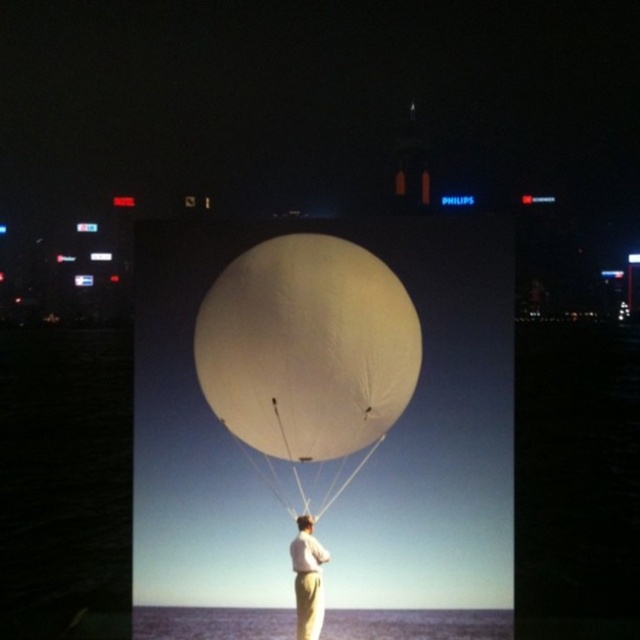
Does transparent plastic water at lower center appear under light beige pants at center?

Correct, transparent plastic water at lower center is located below light beige pants at center.

Is point (269, 632) closer to viewer compared to point (310, 557)?

No, (269, 632) is further to viewer.

Does point (394, 632) lie in front of point (307, 582)?

No.

You are a GUI agent. You are given a task and a screenshot of the screen. Output one action in this format:
    pyautogui.click(x=<x>, y=<y>)
    Task: Click on the transparent plastic water at lower center
    
    Given the screenshot: What is the action you would take?
    pyautogui.click(x=417, y=625)

Can you confirm if white matte balloon at center is bigger than transparent plastic water at lower center?

Indeed, white matte balloon at center has a larger size compared to transparent plastic water at lower center.

Looking at this image, can you confirm if white matte balloon at center is positioned below transparent plastic water at lower center?

No, white matte balloon at center is not below transparent plastic water at lower center.

This screenshot has height=640, width=640. What are the coordinates of `white matte balloon at center` in the screenshot? It's located at (307, 348).

Does white matte balloon at center appear on the left side of light beige pants at center?

Indeed, white matte balloon at center is positioned on the left side of light beige pants at center.

Measure the distance between white matte balloon at center and light beige pants at center.

23.79 feet

Measure the distance between white matte balloon at center and camera.

The distance of white matte balloon at center from camera is 36.15 meters.

Locate an element on the screen. The width and height of the screenshot is (640, 640). white matte balloon at center is located at coordinates (307, 348).